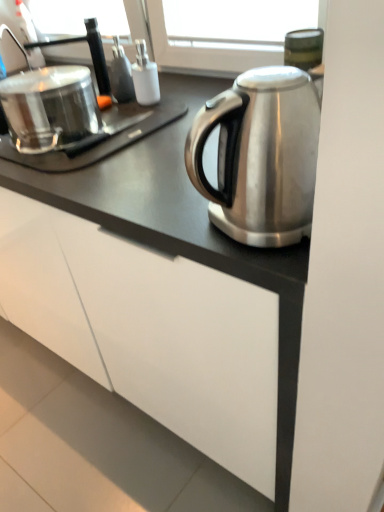
This screenshot has width=384, height=512. I want to click on free spot in front of shiny metallic pot at left, so click(75, 174).